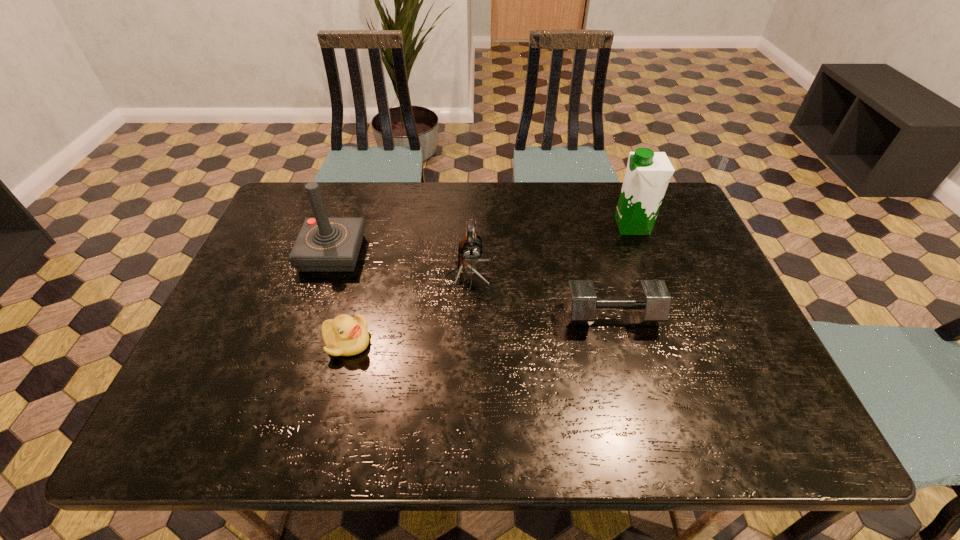
Identify the location of vacant region located 0.200m on the back of the third tallest object. (469, 215).

You are a GUI agent. You are given a task and a screenshot of the screen. Output one action in this format:
    pyautogui.click(x=<x>, y=<y>)
    Task: Click on the free spot located on the right of the dumbbell
    
    Given the screenshot: What is the action you would take?
    pyautogui.click(x=737, y=316)

Identify the location of vacant area located 0.310m on the front-facing side of the duckling. This screenshot has height=540, width=960. (504, 342).

Locate an element on the screen. This screenshot has width=960, height=540. object that is at the far edge is located at coordinates (648, 173).

Where is `object situated at the left edge`? The width and height of the screenshot is (960, 540). object situated at the left edge is located at coordinates (323, 244).

Find the location of `object that is positioned at the right edge`. object that is positioned at the right edge is located at coordinates (648, 173).

You are a GUI agent. You are given a task and a screenshot of the screen. Output one action in this format:
    pyautogui.click(x=<x>, y=<y>)
    Task: Click on the object present at the far right corner
    Image resolution: width=960 pixels, height=540 pixels.
    Given the screenshot: What is the action you would take?
    tap(648, 173)

This screenshot has width=960, height=540. In order to click on vacant space at the far edge of the desktop in this screenshot , I will do `click(564, 206)`.

Where is `vacant area at the near edge`? Image resolution: width=960 pixels, height=540 pixels. vacant area at the near edge is located at coordinates (256, 431).

The width and height of the screenshot is (960, 540). In the image, there is a desktop. Identify the location of blank space at the left edge. (243, 307).